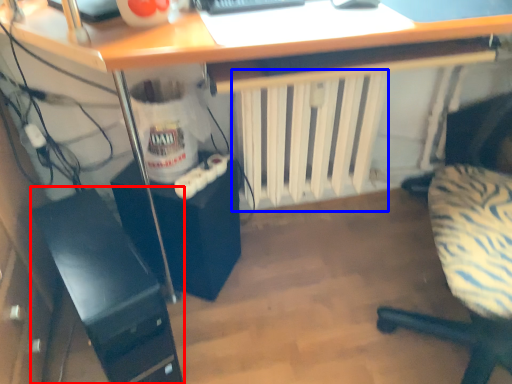
Question: Which object appears farthest to the camera in this image, computer tower (highlighted by a red box) or radiator (highlighted by a blue box)?

Choices:
 (A) computer tower
 (B) radiator

Answer: (B)